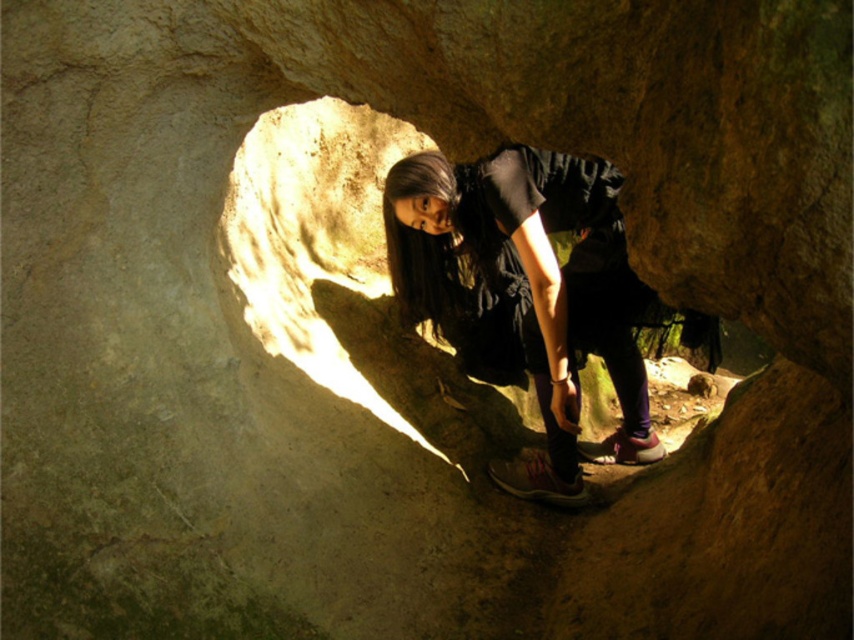
Question: Which object is positioned farthest from the matte black dress at center?

Choices:
 (A) smooth stone hole at center
 (B) matte pink sneaker at lower center

Answer: (B)

Question: In this image, where is matte black dress at center located relative to pink suede shoe at lower center?

Choices:
 (A) below
 (B) above

Answer: (B)

Question: Based on their relative distances, which object is farther from the matte pink sneaker at lower center?

Choices:
 (A) smooth stone hole at center
 (B) matte black dress at center

Answer: (A)

Question: Is smooth stone hole at center smaller than pink suede shoe at lower center?

Choices:
 (A) no
 (B) yes

Answer: (A)

Question: Can you confirm if smooth stone hole at center is positioned below matte pink sneaker at lower center?

Choices:
 (A) no
 (B) yes

Answer: (A)

Question: Based on their relative distances, which object is nearer to the matte black dress at center?

Choices:
 (A) pink suede shoe at lower center
 (B) matte pink sneaker at lower center

Answer: (B)